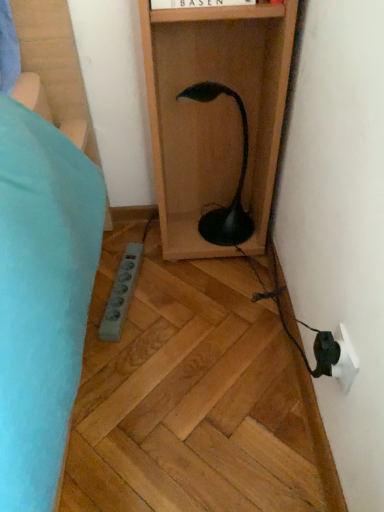
In order to face white plastic electric outlet at lower right, should I rotate leftwards or rightwards?

Turn right approximately 18.767 degrees to face it.

What is the approximate height of white plastic electric outlet at lower right?

It is 3.42 inches.

At what (x,y) coordinates should I click in order to perform the action: click on white plastic electric outlet at lower right. Please return your answer as a coordinate pair (x, y). This screenshot has width=384, height=512. Looking at the image, I should click on (345, 361).

The width and height of the screenshot is (384, 512). What do you see at coordinates (345, 361) in the screenshot? I see `white plastic electric outlet at lower right` at bounding box center [345, 361].

Locate an element on the screen. black glossy lamp at center is located at coordinates (238, 183).

What do you see at coordinates (238, 183) in the screenshot? This screenshot has width=384, height=512. I see `black glossy lamp at center` at bounding box center [238, 183].

Measure the distance between point (237, 103) and camera.

The distance of point (237, 103) from camera is 1.13 meters.

I want to click on white plastic electric outlet at lower right, so click(345, 361).

Visually, is white plastic electric outlet at lower right positioned to the left or to the right of black glossy lamp at center?

In the image, white plastic electric outlet at lower right appears on the right side of black glossy lamp at center.

Which object is closer to the camera, white plastic electric outlet at lower right or black glossy lamp at center?

white plastic electric outlet at lower right is more forward.

Is point (357, 359) positioned in front of point (240, 238)?

Yes, it is in front of point (240, 238).

From the image's perspective, which one is positioned lower, white plastic electric outlet at lower right or black glossy lamp at center?

white plastic electric outlet at lower right is shown below in the image.

From a real-world perspective, is white plastic electric outlet at lower right physically above black glossy lamp at center?

No, from a real-world perspective, white plastic electric outlet at lower right is not on top of black glossy lamp at center.

Is white plastic electric outlet at lower right thinner than black glossy lamp at center?

Yes, white plastic electric outlet at lower right is thinner than black glossy lamp at center.

From their relative heights in the image, would you say white plastic electric outlet at lower right is taller or shorter than black glossy lamp at center?

Clearly, white plastic electric outlet at lower right is shorter compared to black glossy lamp at center.

In terms of size, does white plastic electric outlet at lower right appear bigger or smaller than black glossy lamp at center?

In the image, white plastic electric outlet at lower right appears to be smaller than black glossy lamp at center.

From the picture: Is white plastic electric outlet at lower right positioned beyond the bounds of black glossy lamp at center?

Indeed, white plastic electric outlet at lower right is completely outside black glossy lamp at center.

Is white plastic electric outlet at lower right with black glossy lamp at center?

white plastic electric outlet at lower right and black glossy lamp at center are not in contact.

Could you tell me if white plastic electric outlet at lower right is facing black glossy lamp at center?

No, white plastic electric outlet at lower right is not oriented towards black glossy lamp at center.

What's the angular difference between white plastic electric outlet at lower right and black glossy lamp at center's facing directions?

They differ by 90 degrees in their facing directions.

What are the coordinates of `lamp above the white plastic electric outlet at lower right (from a real-world perspective)` in the screenshot? It's located at (238, 183).

Which object is positioned more to the left, black glossy lamp at center or white plastic electric outlet at lower right?

black glossy lamp at center is more to the left.

Is black glossy lamp at center positioned before white plastic electric outlet at lower right?

No, the depth of black glossy lamp at center is greater than that of white plastic electric outlet at lower right.

Is point (231, 216) farther from viewer compared to point (351, 354)?

Yes, point (231, 216) is farther from viewer.

From the image's perspective, who appears lower, black glossy lamp at center or white plastic electric outlet at lower right?

white plastic electric outlet at lower right, from the image's perspective.

From a real-world perspective, is black glossy lamp at center positioned over white plastic electric outlet at lower right based on gravity?

Yes, from a real-world perspective, black glossy lamp at center is over white plastic electric outlet at lower right

In the scene shown: Is black glossy lamp at center thinner than white plastic electric outlet at lower right?

In fact, black glossy lamp at center might be wider than white plastic electric outlet at lower right.

Can you confirm if black glossy lamp at center is taller than white plastic electric outlet at lower right?

Indeed, black glossy lamp at center has a greater height compared to white plastic electric outlet at lower right.

Considering the relative sizes of black glossy lamp at center and white plastic electric outlet at lower right in the image provided, is black glossy lamp at center smaller than white plastic electric outlet at lower right?

Actually, black glossy lamp at center might be larger than white plastic electric outlet at lower right.

Would you say white plastic electric outlet at lower right is part of black glossy lamp at center's contents?

Definitely not — white plastic electric outlet at lower right is not inside black glossy lamp at center.

Is black glossy lamp at center in contact with white plastic electric outlet at lower right?

black glossy lamp at center and white plastic electric outlet at lower right are not in contact.

Is white plastic electric outlet at lower right at the back of black glossy lamp at center?

black glossy lamp at center is not turned away from white plastic electric outlet at lower right.

How different are the orientations of black glossy lamp at center and white plastic electric outlet at lower right in degrees?

black glossy lamp at center and white plastic electric outlet at lower right are facing 90 degrees away from each other.

Looking at this image, measure the distance between black glossy lamp at center and white plastic electric outlet at lower right.

black glossy lamp at center and white plastic electric outlet at lower right are 25.35 inches apart.

Find the location of a particular element. electric outlet to the right of black glossy lamp at center is located at coordinates (345, 361).

Where is `electric outlet that appears below the black glossy lamp at center (from a real-world perspective)`? electric outlet that appears below the black glossy lamp at center (from a real-world perspective) is located at coordinates (345, 361).

Identify the location of electric outlet on the right of black glossy lamp at center. (345, 361).